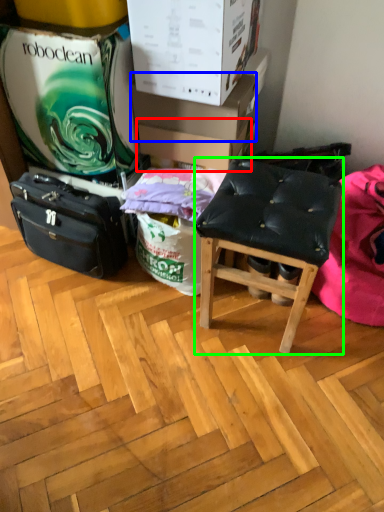
Question: Estimate the real-world distances between objects in this image. Which object is closer to cardboard box (highlighted by a red box), cardboard box (highlighted by a blue box) or stool (highlighted by a green box)?

Choices:
 (A) cardboard box
 (B) stool

Answer: (A)